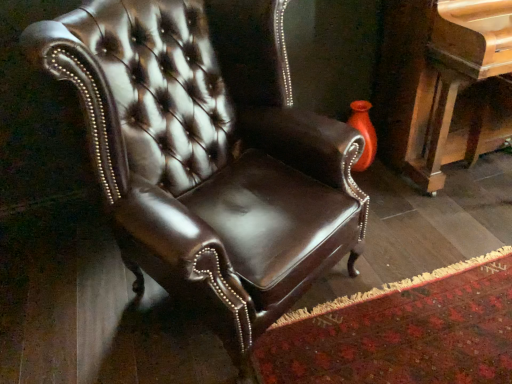
Question: Would you say shiny brown leather chair at center is part of polished wood piano at right's contents?

Choices:
 (A) yes
 (B) no

Answer: (B)

Question: Is polished wood piano at right to the right of shiny brown leather chair at center from the viewer's perspective?

Choices:
 (A) yes
 (B) no

Answer: (A)

Question: Is polished wood piano at right outside shiny brown leather chair at center?

Choices:
 (A) no
 (B) yes

Answer: (B)

Question: Are polished wood piano at right and shiny brown leather chair at center located far from each other?

Choices:
 (A) yes
 (B) no

Answer: (B)

Question: Is polished wood piano at right facing away from shiny brown leather chair at center?

Choices:
 (A) yes
 (B) no

Answer: (B)

Question: Is polished wood piano at right smaller than shiny brown leather chair at center?

Choices:
 (A) yes
 (B) no

Answer: (A)

Question: Is shiny brown leather chair at center next to polished wood piano at right?

Choices:
 (A) yes
 (B) no

Answer: (B)

Question: Considering the relative sizes of shiny brown leather chair at center and polished wood piano at right in the image provided, is shiny brown leather chair at center smaller than polished wood piano at right?

Choices:
 (A) yes
 (B) no

Answer: (B)

Question: Considering the relative positions of shiny brown leather chair at center and polished wood piano at right in the image provided, is shiny brown leather chair at center to the right of polished wood piano at right from the viewer's perspective?

Choices:
 (A) no
 (B) yes

Answer: (A)

Question: From the image's perspective, is shiny brown leather chair at center below polished wood piano at right?

Choices:
 (A) yes
 (B) no

Answer: (A)

Question: Is shiny brown leather chair at center facing towards polished wood piano at right?

Choices:
 (A) yes
 (B) no

Answer: (B)

Question: Considering the relative sizes of shiny brown leather chair at center and polished wood piano at right in the image provided, is shiny brown leather chair at center shorter than polished wood piano at right?

Choices:
 (A) no
 (B) yes

Answer: (A)

Question: From a real-world perspective, is shiny brown leather chair at center positioned above or below polished wood piano at right?

Choices:
 (A) below
 (B) above

Answer: (B)